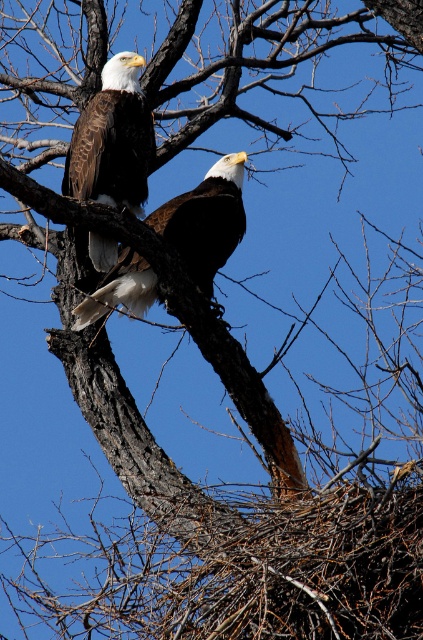
You are a photographer trying to capture a closeup of the bald eagle at point (79, 257). You notice another point at (231, 220) in the background. Which point is closer to your camera?

Point (79, 257) is closer to the camera than point (231, 220) because it is further to the camera than the other point.